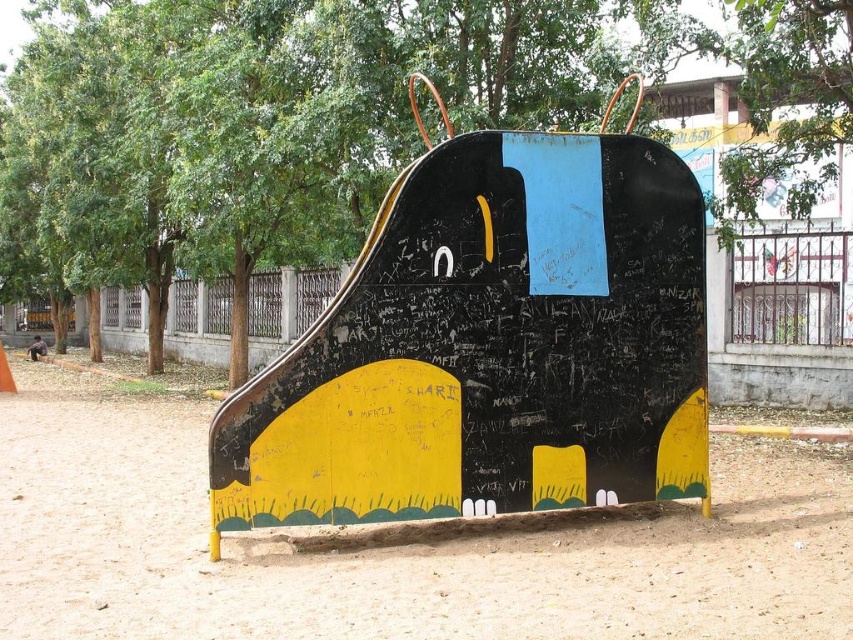
Between matte black slide at center and fine-grained sand at lower center, which one has less height?

fine-grained sand at lower center is shorter.

Who is positioned more to the right, matte black slide at center or fine-grained sand at lower center?

Positioned to the right is matte black slide at center.

Is point (303, 355) less distant than point (172, 634)?

No, (303, 355) is behind (172, 634).

Image resolution: width=853 pixels, height=640 pixels. In order to click on matte black slide at center in this screenshot , I will do `click(488, 349)`.